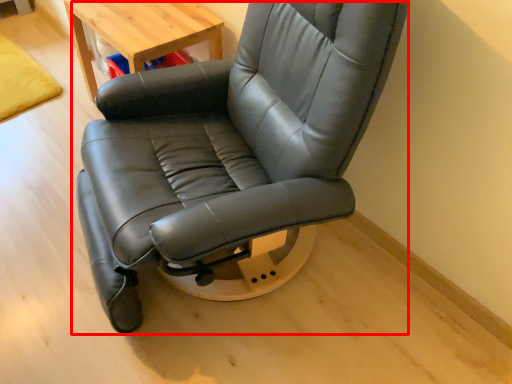
Question: Considering the relative positions of chair (annotated by the red box) and table in the image provided, where is chair (annotated by the red box) located with respect to the staircase?

Choices:
 (A) left
 (B) right

Answer: (B)